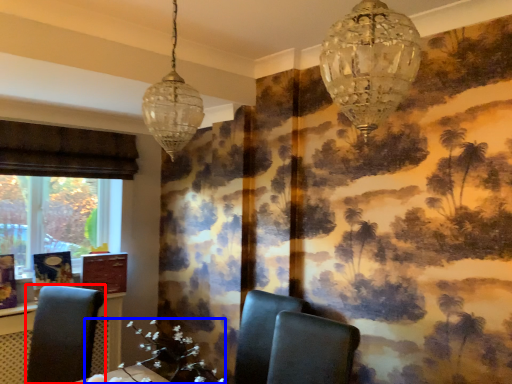
Question: Among these objects, which one is farthest to the camera, chair (highlighted by a red box) or flower (highlighted by a blue box)?

Choices:
 (A) chair
 (B) flower

Answer: (A)